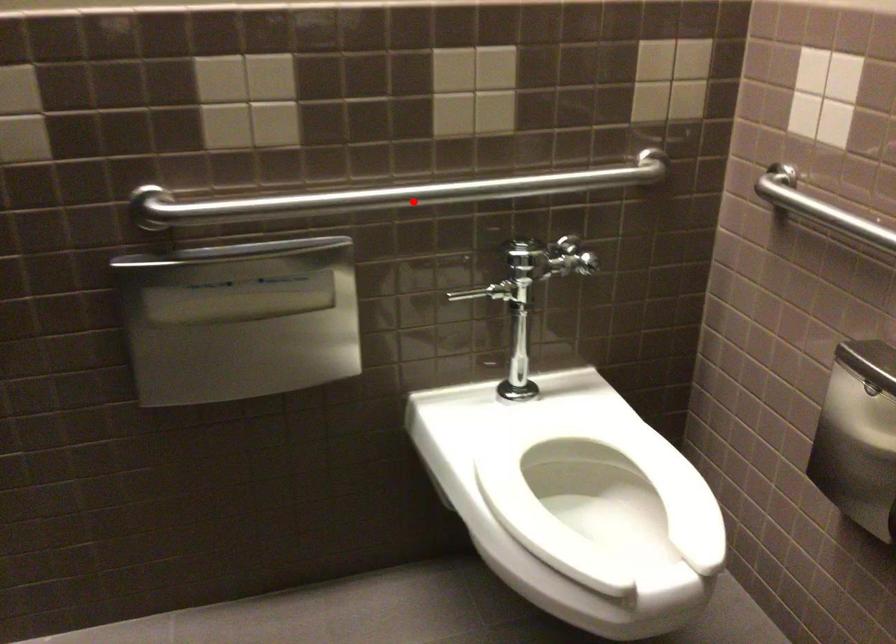
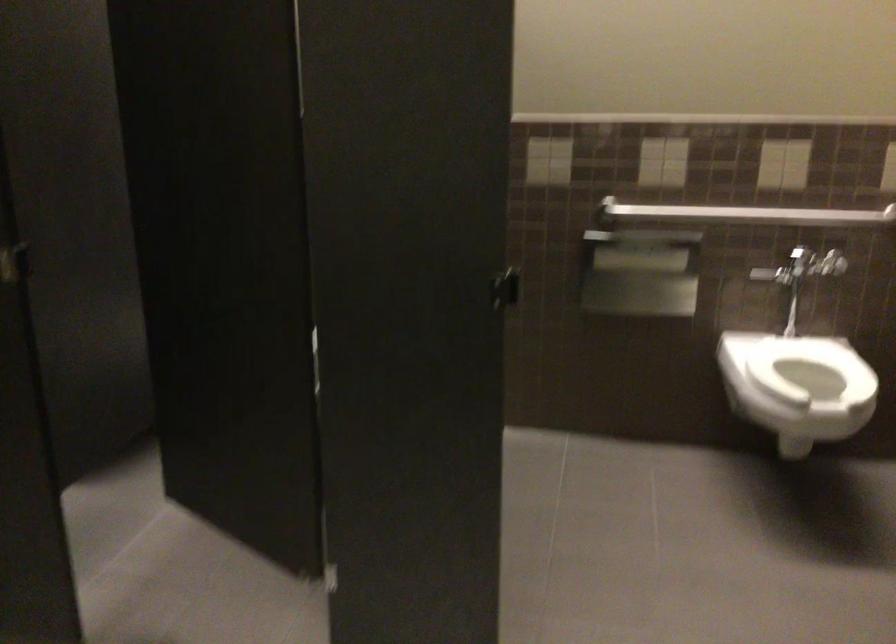
Where in the second image is the point corresponding to the highlighted location from the first image?

(745, 214)